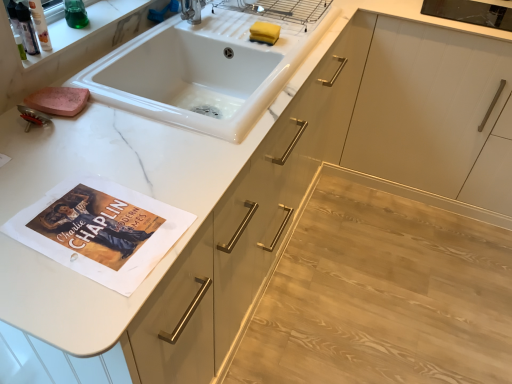
Question: Considering the relative positions of white glossy sink at upper center and yellow sponge at sink in the image provided, is white glossy sink at upper center to the left or to the right of yellow sponge at sink?

Choices:
 (A) left
 (B) right

Answer: (A)

Question: Do you think white glossy sink at upper center is within yellow sponge at sink, or outside of it?

Choices:
 (A) outside
 (B) inside

Answer: (A)

Question: Estimate the real-world distances between objects in this image. Which object is closer to the white marble shelf at upper left?

Choices:
 (A) light wood floor at lower right
 (B) yellow sponge at sink
 (C) white glossy sink at upper center

Answer: (C)

Question: Which object is the farthest from the white marble shelf at upper left?

Choices:
 (A) yellow sponge at sink
 (B) white glossy sink at upper center
 (C) light wood floor at lower right

Answer: (C)